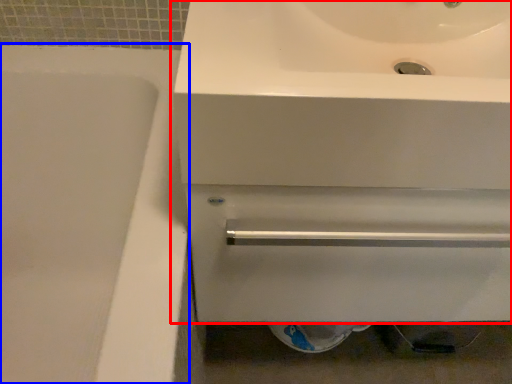
Question: Which point is closer to the camera, sink (highlighted by a red box) or bath (highlighted by a blue box)?

Choices:
 (A) sink
 (B) bath

Answer: (B)